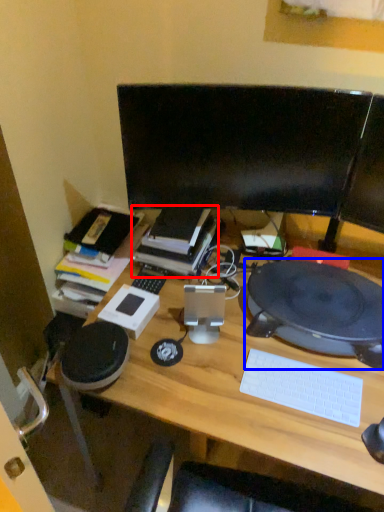
Question: Which of the following is the farthest to the observer, book (highlighted by a red box) or computer (highlighted by a blue box)?

Choices:
 (A) book
 (B) computer

Answer: (A)